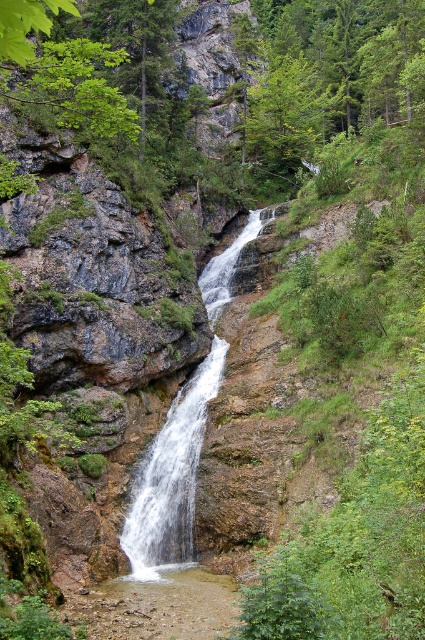
Question: Is white frothy water at center in front of white smooth waterfall at center?

Choices:
 (A) yes
 (B) no

Answer: (B)

Question: Can you confirm if white frothy water at center is positioned to the left of white smooth waterfall at center?

Choices:
 (A) no
 (B) yes

Answer: (A)

Question: Which object is closer to the camera taking this photo?

Choices:
 (A) white frothy water at center
 (B) white smooth waterfall at center

Answer: (B)

Question: Is white frothy water at center thinner than white smooth waterfall at center?

Choices:
 (A) no
 (B) yes

Answer: (A)